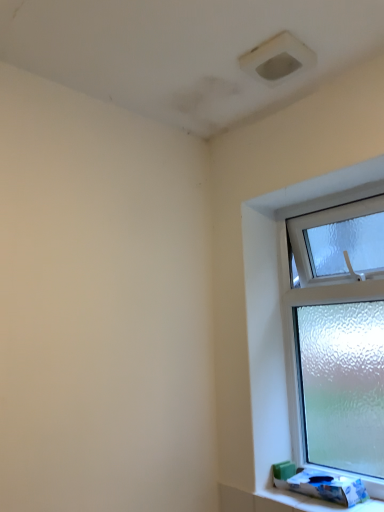
The height and width of the screenshot is (512, 384). What do you see at coordinates (289, 309) in the screenshot?
I see `frosted glass window at right` at bounding box center [289, 309].

The width and height of the screenshot is (384, 512). In order to click on frosted glass window at right in this screenshot , I will do `click(289, 309)`.

The width and height of the screenshot is (384, 512). I want to click on frosted glass window at right, so click(289, 309).